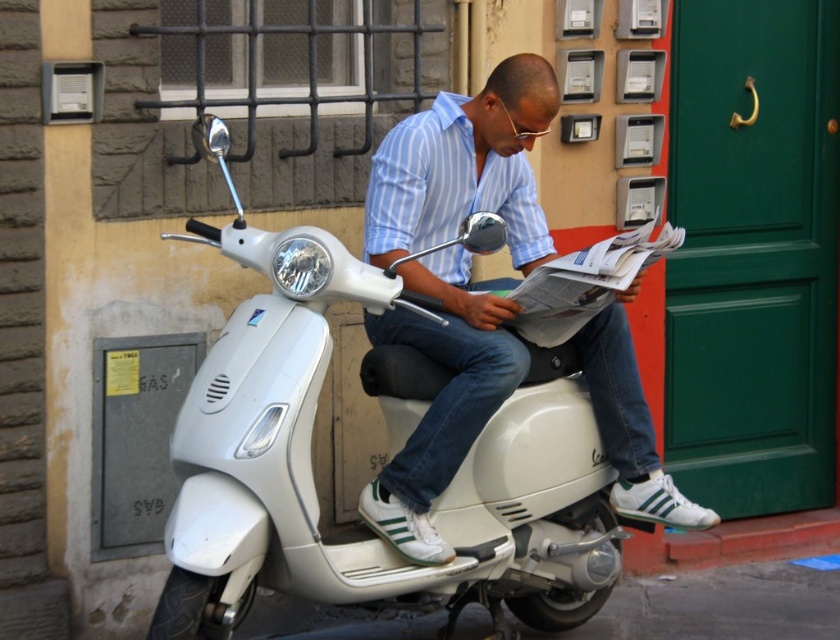
Describe the element at coordinates (312, 474) in the screenshot. The image size is (840, 640). I see `white matte motorbike at center` at that location.

Is point (219, 403) closer to camera compared to point (424, 176)?

Yes, it is.

Locate an element on the screen. The width and height of the screenshot is (840, 640). white matte motorbike at center is located at coordinates (312, 474).